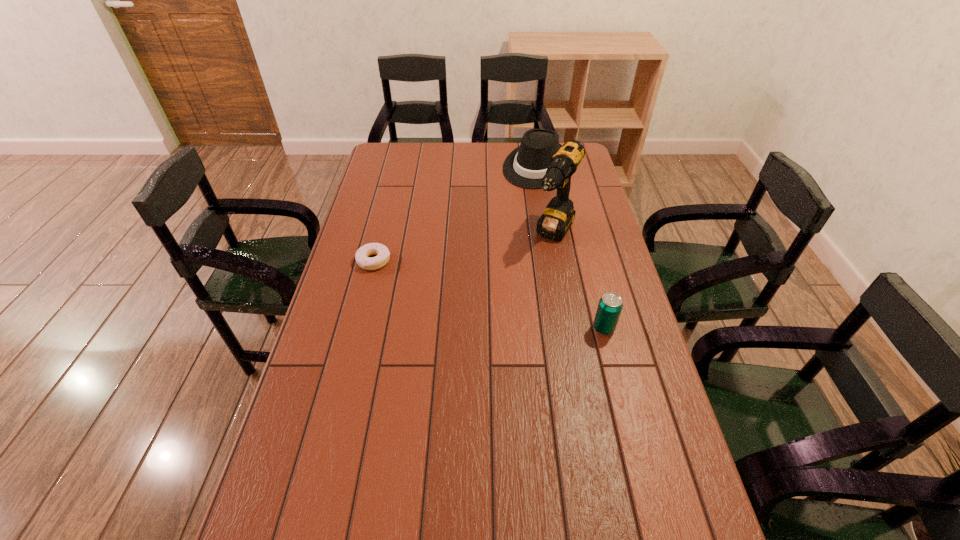
What are the coordinates of `free space on the desktop that is between the leftmost object and the beer can and is positioned at the tip of the tallest object` in the screenshot? It's located at (516, 302).

This screenshot has width=960, height=540. Identify the location of free space on the desktop that is between the shortest object and the beer can and is positioned on the front-facing side of the farthest object. (453, 284).